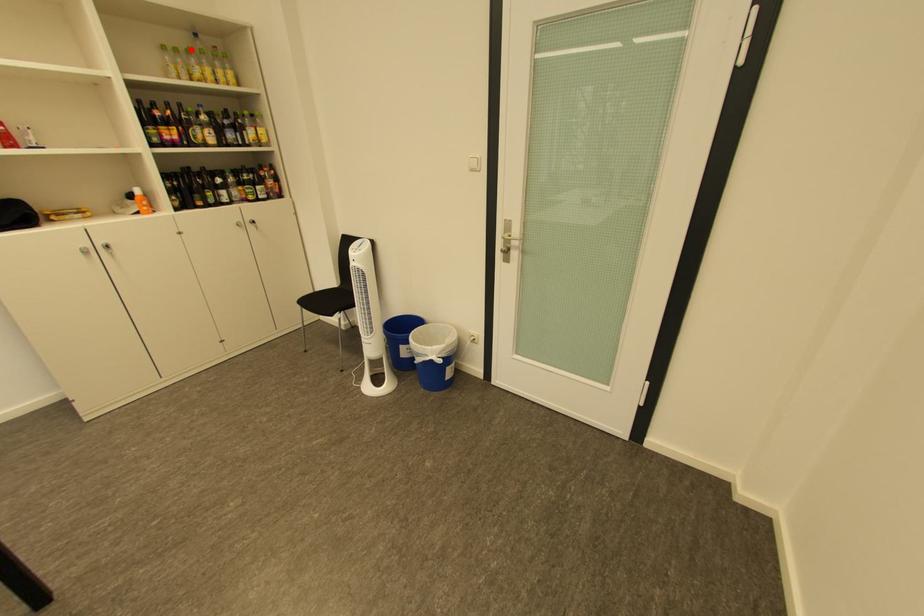
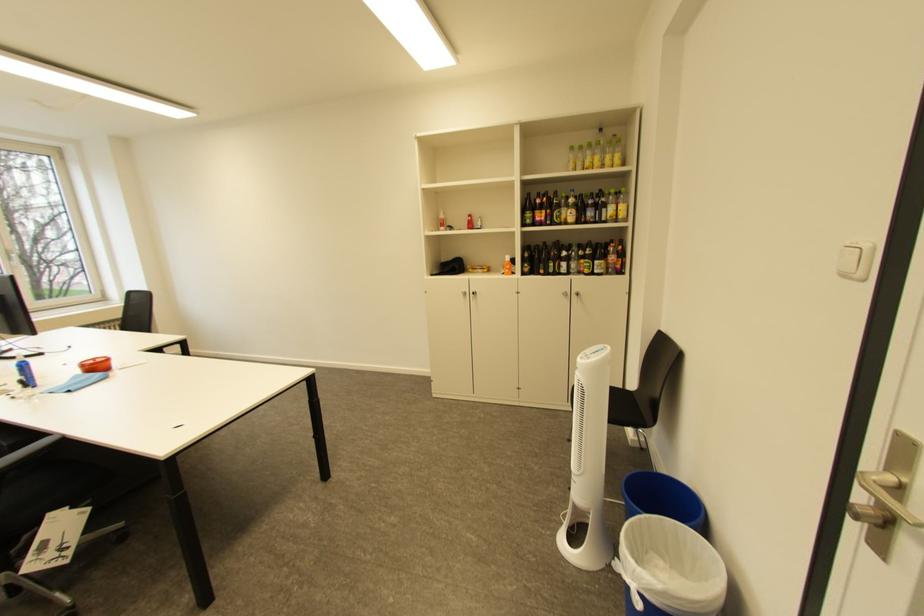
Question: I am providing you with two images of the same scene from different viewpoints. In image1, a red point is highlighted. Considering the same 3D point in image2, which of the following is correct?

Choices:
 (A) It is closer
 (B) It is farther

Answer: (A)